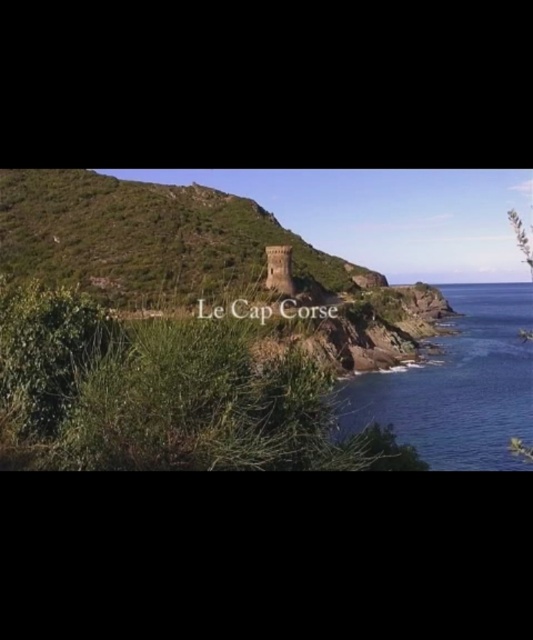
You are standing at the point labeled as point [151,240] in the image. Based on the scene description, what type of terrain are you currently standing on?

You are standing on the green grassy hillside at center, which is part of the rocky and grassy terrain of the hillside in the midground described in the scene.